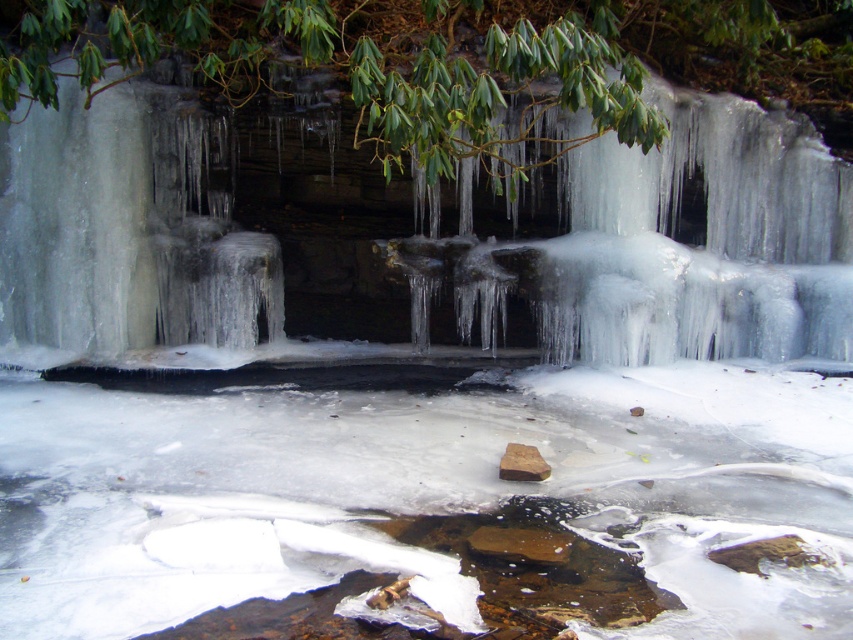
Question: Observing the image, what is the correct spatial positioning of clear ice waterfall at upper center in reference to brown matte stone at center?

Choices:
 (A) above
 (B) below

Answer: (A)

Question: Which point is farther to the camera?

Choices:
 (A) (509, 461)
 (B) (776, 236)

Answer: (B)

Question: Which object is the closest to the brown matte stone at center?

Choices:
 (A) green leafy branch at upper center
 (B) clear ice waterfall at upper center

Answer: (A)

Question: Can you confirm if green leafy branch at upper center is thinner than brown matte stone at center?

Choices:
 (A) yes
 (B) no

Answer: (B)

Question: Considering the relative positions of green leafy branch at upper center and clear ice waterfall at upper center in the image provided, where is green leafy branch at upper center located with respect to clear ice waterfall at upper center?

Choices:
 (A) above
 (B) below

Answer: (A)

Question: Considering the real-world distances, which object is closest to the clear ice waterfall at upper center?

Choices:
 (A) green leafy branch at upper center
 (B) brown matte stone at center

Answer: (A)